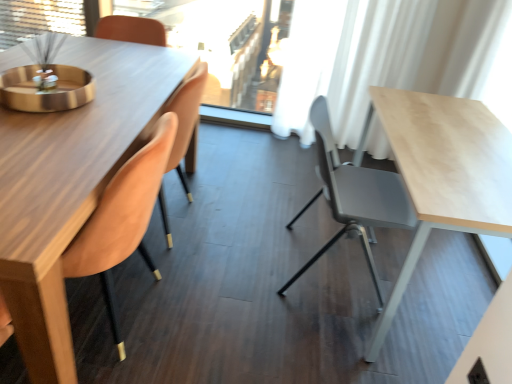
What are the coordinates of `vacant space to the left of matte gray chair at center, which is the 1th chair from right to left` in the screenshot? It's located at (246, 254).